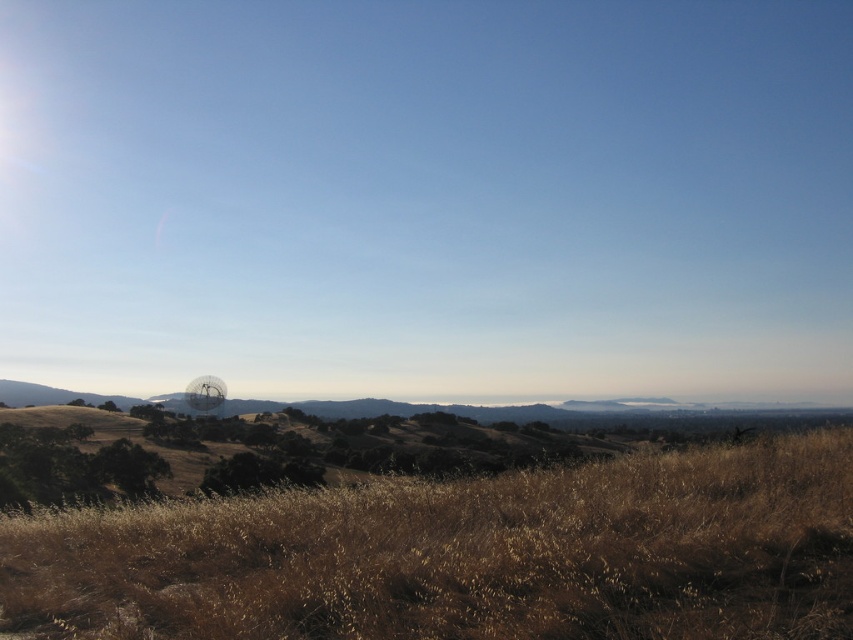
Question: Does brown dry grass at lower center have a lesser width compared to brown grassland at center?

Choices:
 (A) yes
 (B) no

Answer: (A)

Question: Is brown dry grass at lower center thinner than brown grassland at center?

Choices:
 (A) yes
 (B) no

Answer: (A)

Question: Which object is closer to the camera taking this photo?

Choices:
 (A) brown grassland at center
 (B) brown dry grass at lower center

Answer: (B)

Question: Which point appears farthest from the camera in this image?

Choices:
 (A) (625, 406)
 (B) (80, 618)

Answer: (A)

Question: Is brown dry grass at lower center above brown grassland at center?

Choices:
 (A) yes
 (B) no

Answer: (A)

Question: Which point is farther to the camera?

Choices:
 (A) brown grassland at center
 (B) brown dry grass at lower center

Answer: (A)